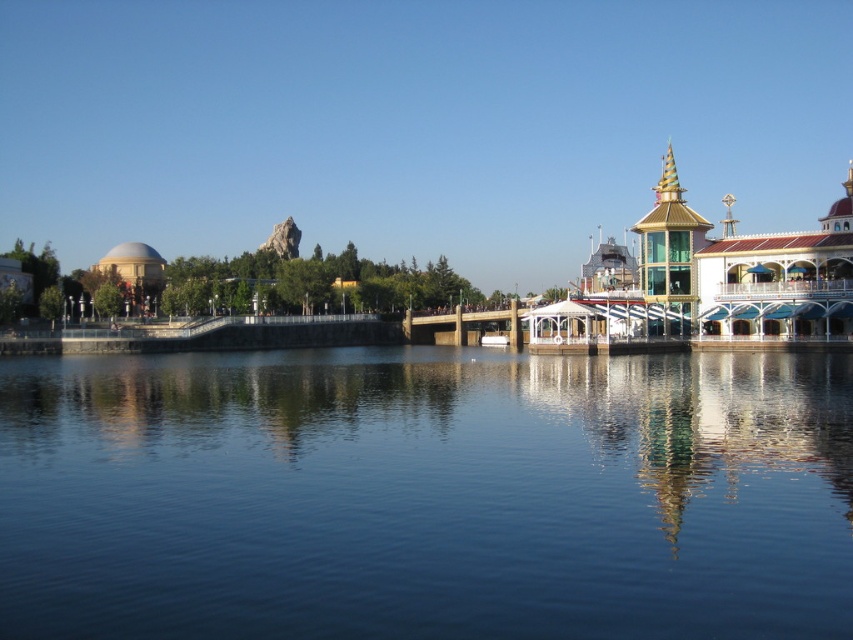
From the picture: You are standing in the waterfront scene of the theme park and want to place a small decorative flag at the point closer to you between point (x=285, y=429) and point (x=622, y=344). Which point should you choose?

You should choose point (x=285, y=429) because it is closer to the viewer than point (x=622, y=344).

You are a visitor standing at the waterfront in the theme park. You see the white glossy building at center and the white plastic boat at center. Which one is closer to you?

The white glossy building at center is closer to you because it is in front of the white plastic boat at center.

You are a visitor at this waterfront theme park and want to take a photo of both the white glossy building at center and the white plastic boat at center from the dock. Which object should you position closer to the camera to ensure both fit in the frame?

Since the white glossy building at center is wider than the white plastic boat at center, you should position the building closer to the camera to ensure both fit in the frame.